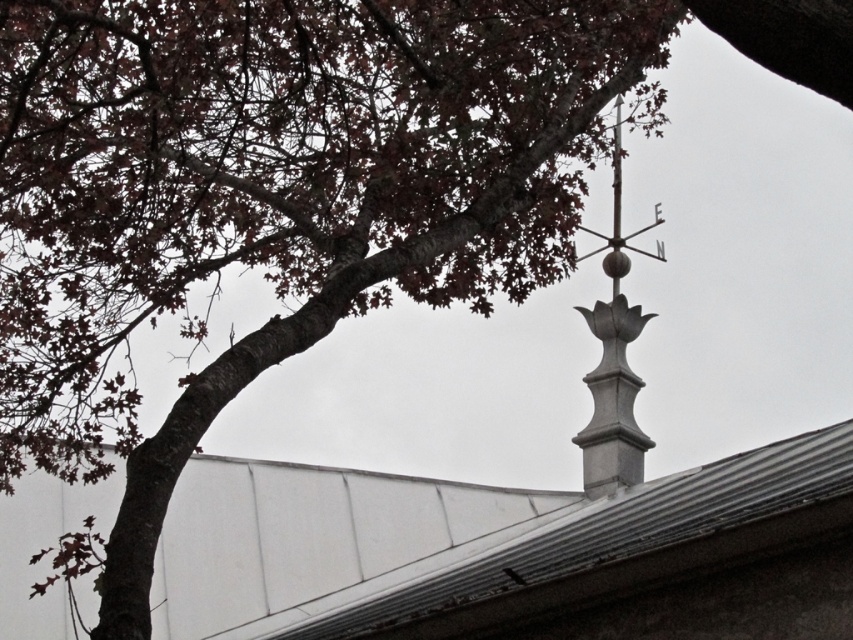
Looking at this image, you are a window cleaner standing on a ladder. You see the white stone spire at upper center and the white polished metal vane at center. Which object is taller?

The white stone spire at upper center is taller than the white polished metal vane at center.

You are standing on the ground looking up at the roof. Which object is closer to the peak of the roof, the white stone spire at upper center or the white polished metal vane at center?

The white polished metal vane at center is closer to the peak of the roof because the white stone spire at upper center is located below it.

You are a maintenance worker inspecting the roof. You notice the white stone spire at upper center and the white polished metal vane at center. Which object is bigger in size?

The white stone spire at upper center is larger in size compared to the white polished metal vane at center according to the description.